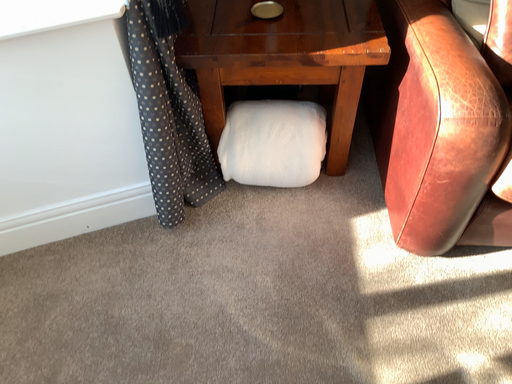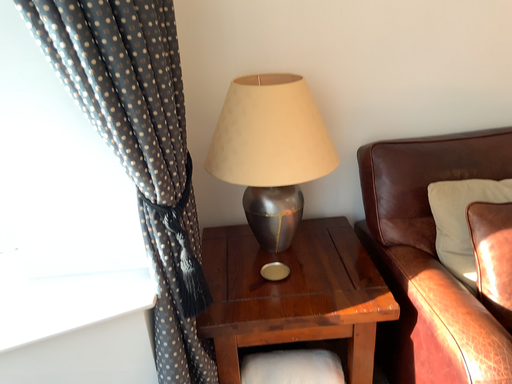
Question: How did the camera likely rotate when shooting the video?

Choices:
 (A) rotated downward
 (B) rotated upward

Answer: (B)